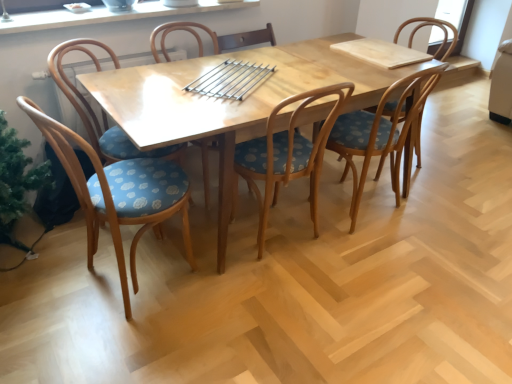
Locate an element on the screen. The image size is (512, 384). free location in front of natural wood table at center is located at coordinates click(x=279, y=319).